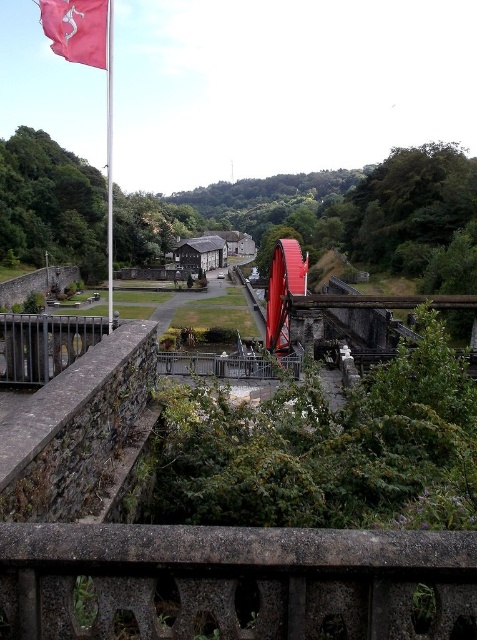
In the scene shown: You are standing at the viewpoint overlooking the historic watermill complex. You notice a pink fabric flag at upper left and a red metallic flag pole at upper left. Which object is located to the right of the other?

The pink fabric flag at upper left is positioned on the right side of the red metallic flag pole at upper left.

You are standing at the viewpoint looking at the historic watermill complex. There is a point marked at coordinate (235, 579). What object is located at that coordinate?

The point at coordinate (235, 579) indicates the concrete textured balustrade at lower center.